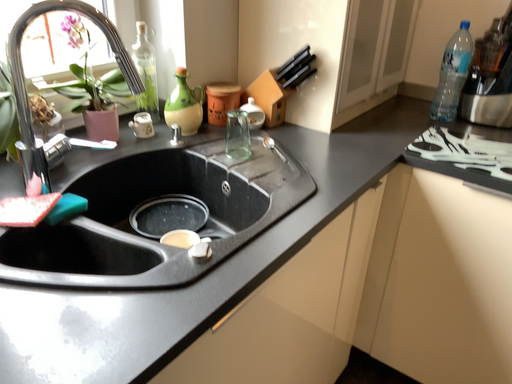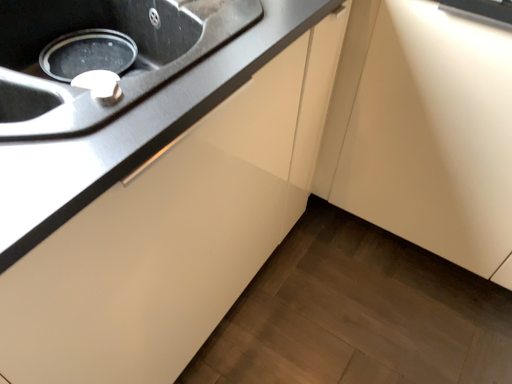
Question: How did the camera likely rotate when shooting the video?

Choices:
 (A) rotated upward
 (B) rotated downward

Answer: (B)